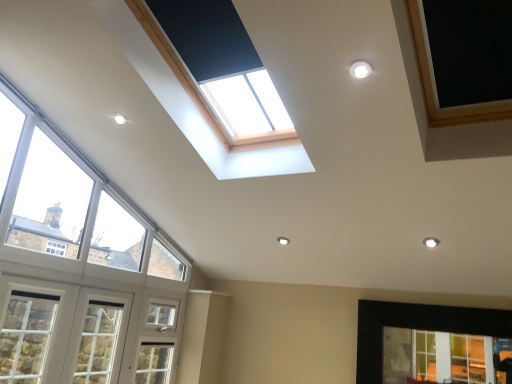
Question: Is clear glass window at lower right, the 1th window positioned from the right, wider than white painted wood window at lower left, positioned as the 1th window in left-to-right order?

Choices:
 (A) no
 (B) yes

Answer: (A)

Question: Is white painted wood window at lower left, placed as the fourth window when sorted from right to left, located within clear glass window at lower right, the 1th window positioned from the right?

Choices:
 (A) yes
 (B) no

Answer: (B)

Question: Are clear glass window at lower right, the 1th window positioned from the right, and white painted wood window at lower left, positioned as the 1th window in left-to-right order, far apart?

Choices:
 (A) yes
 (B) no

Answer: (A)

Question: Is clear glass window at lower right, which is the fourth window from left to right, closer to camera compared to white painted wood window at lower left, placed as the fourth window when sorted from right to left?

Choices:
 (A) no
 (B) yes

Answer: (A)

Question: From the image's perspective, is clear glass window at lower right, the 1th window positioned from the right, beneath white painted wood window at lower left, positioned as the 1th window in left-to-right order?

Choices:
 (A) yes
 (B) no

Answer: (A)

Question: In the image, is clear glass window at lower right, which is the fourth window from left to right, positioned in front of or behind clear glass window at left, which is the 2th window from right to left?

Choices:
 (A) front
 (B) behind

Answer: (B)

Question: Looking at their shapes, would you say clear glass window at lower right, the 1th window positioned from the right, is wider or thinner than clear glass window at left, which is the 2th window from right to left?

Choices:
 (A) wide
 (B) thin

Answer: (B)

Question: From a real-world perspective, is clear glass window at lower right, which is the fourth window from left to right, above or below clear glass window at left, placed as the third window when sorted from left to right?

Choices:
 (A) above
 (B) below

Answer: (B)

Question: Based on their positions, is clear glass window at lower right, the 1th window positioned from the right, located to the left or right of clear glass window at left, placed as the third window when sorted from left to right?

Choices:
 (A) right
 (B) left

Answer: (A)

Question: Is white painted wood window at lower left, positioned as the 1th window in left-to-right order, inside the boundaries of white wood window at lower left, arranged as the third window when viewed from the right, or outside?

Choices:
 (A) outside
 (B) inside

Answer: (B)

Question: Is white painted wood window at lower left, positioned as the 1th window in left-to-right order, bigger or smaller than white wood window at lower left, arranged as the 2th window when viewed from the left?

Choices:
 (A) small
 (B) big

Answer: (A)

Question: From a real-world perspective, is white painted wood window at lower left, placed as the fourth window when sorted from right to left, above or below white wood window at lower left, arranged as the 2th window when viewed from the left?

Choices:
 (A) below
 (B) above

Answer: (A)

Question: Is point (1, 362) positioned closer to the camera than point (45, 319)?

Choices:
 (A) closer
 (B) farther

Answer: (A)

Question: Would you say white painted wood window at lower left, positioned as the 1th window in left-to-right order, is inside or outside clear glass window at left, placed as the third window when sorted from left to right?

Choices:
 (A) outside
 (B) inside

Answer: (A)

Question: Is white painted wood window at lower left, positioned as the 1th window in left-to-right order, in front of or behind clear glass window at left, which is the 2th window from right to left, in the image?

Choices:
 (A) behind
 (B) front

Answer: (A)